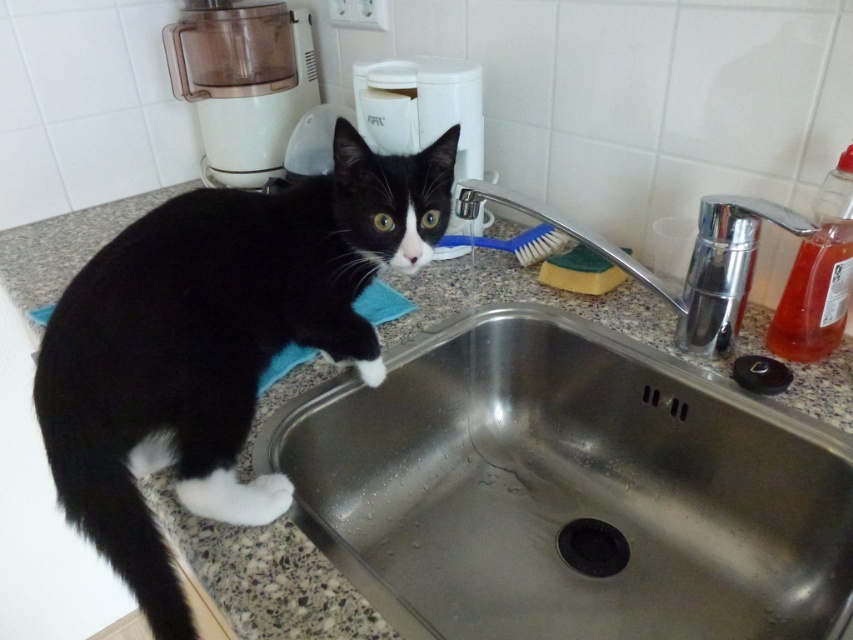
Is granite countertop at upper left shorter than blue plastic brush at center?

In fact, granite countertop at upper left may be taller than blue plastic brush at center.

Is granite countertop at upper left behind blue plastic brush at center?

No, it is in front of blue plastic brush at center.

This screenshot has width=853, height=640. Describe the element at coordinates (265, 577) in the screenshot. I see `granite countertop at upper left` at that location.

Find the location of a particular element. granite countertop at upper left is located at coordinates (265, 577).

Is the position of black fur cat at upper left more distant than that of black rubber drain at lower center?

That is False.

Who is higher up, black fur cat at upper left or black rubber drain at lower center?

black fur cat at upper left

Where is `black fur cat at upper left`? This screenshot has height=640, width=853. black fur cat at upper left is located at coordinates (216, 340).

Between granite countertop at upper left and black rubber drain at lower center, which one is positioned lower?

black rubber drain at lower center is lower down.

Between point (633, 332) and point (569, 564), which one is positioned behind?

Positioned behind is point (633, 332).

This screenshot has height=640, width=853. In order to click on granite countertop at upper left in this screenshot , I will do `click(265, 577)`.